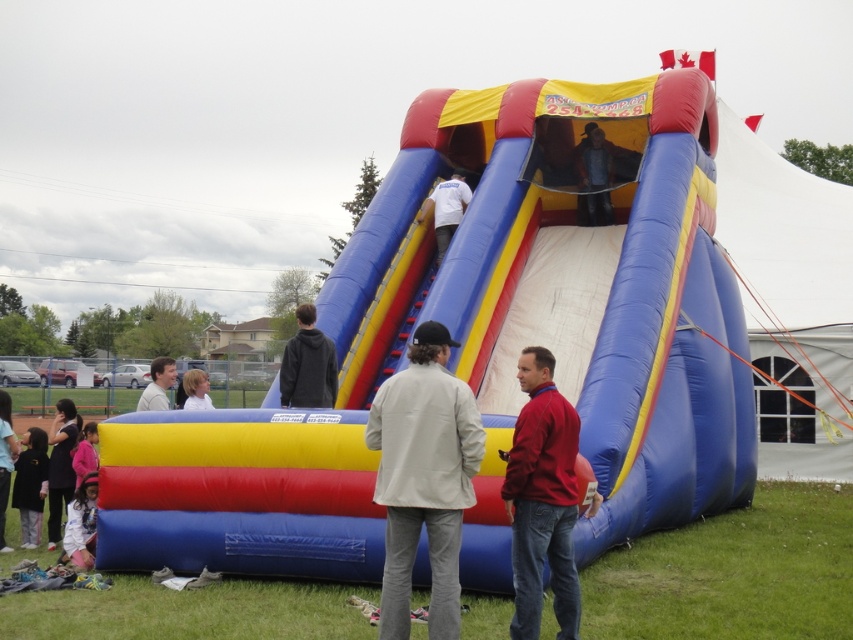
Does white cotton dress at lower left appear over pink fabric child at lower left?

No, white cotton dress at lower left is not above pink fabric child at lower left.

Who is more distant from viewer, [93,545] or [80,451]?

The point [80,451] is behind.

Locate an element on the screen. white cotton dress at lower left is located at coordinates (80, 524).

Identify the location of beige fabric jacket at center. This screenshot has height=640, width=853. (422, 477).

Does beige fabric jacket at center come in front of white cotton dress at lower left?

Yes, it is.

Between point (451, 612) and point (80, 499), which one is positioned in front?

Point (451, 612)

At what (x,y) coordinates should I click in order to perform the action: click on beige fabric jacket at center. Please return your answer as a coordinate pair (x, y). Looking at the image, I should click on (422, 477).

Is beige fabric jacket at center thinner than dark gray hoodie at center?

Yes.

Does point (436, 436) come closer to viewer compared to point (323, 356)?

Yes.

The image size is (853, 640). What are the coordinates of `beige fabric jacket at center` in the screenshot? It's located at (422, 477).